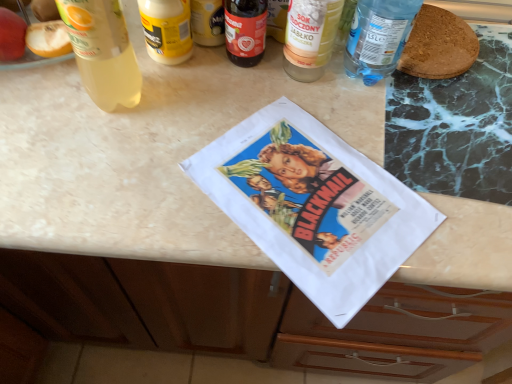
Question: Is translucent glass bottle at upper center, positioned as the 4th bottle in left-to-right order, located within dark red glass bottle at center, the third bottle from the left?

Choices:
 (A) no
 (B) yes

Answer: (A)

Question: Considering the relative sizes of dark red glass bottle at center, the third bottle from the left, and translucent glass bottle at upper center, positioned as the 4th bottle in left-to-right order, in the image provided, is dark red glass bottle at center, the third bottle from the left, wider than translucent glass bottle at upper center, positioned as the 4th bottle in left-to-right order,?

Choices:
 (A) yes
 (B) no

Answer: (A)

Question: Can you confirm if dark red glass bottle at center, the third bottle from the left, is positioned to the right of translucent glass bottle at upper center, positioned as the 4th bottle in left-to-right order?

Choices:
 (A) no
 (B) yes

Answer: (A)

Question: Is dark red glass bottle at center, arranged as the third bottle when viewed from the right, not inside translucent glass bottle at upper center, which is counted as the 2th bottle, starting from the right?

Choices:
 (A) yes
 (B) no

Answer: (A)

Question: From the image's perspective, is dark red glass bottle at center, the third bottle from the left, on top of translucent glass bottle at upper center, positioned as the 4th bottle in left-to-right order?

Choices:
 (A) no
 (B) yes

Answer: (A)

Question: Could you tell me if dark red glass bottle at center, arranged as the third bottle when viewed from the right, is facing translucent glass bottle at upper center, positioned as the 4th bottle in left-to-right order?

Choices:
 (A) no
 (B) yes

Answer: (A)

Question: From a real-world perspective, is yellow matte jar at upper center, marked as the second bottle in a left-to-right arrangement, over dark red glass bottle at center, the third bottle from the left?

Choices:
 (A) no
 (B) yes

Answer: (B)

Question: Is yellow matte jar at upper center, marked as the second bottle in a left-to-right arrangement, facing towards dark red glass bottle at center, arranged as the third bottle when viewed from the right?

Choices:
 (A) yes
 (B) no

Answer: (B)

Question: Considering the relative sizes of yellow matte jar at upper center, marked as the second bottle in a left-to-right arrangement, and dark red glass bottle at center, arranged as the third bottle when viewed from the right, in the image provided, is yellow matte jar at upper center, marked as the second bottle in a left-to-right arrangement, thinner than dark red glass bottle at center, arranged as the third bottle when viewed from the right,?

Choices:
 (A) no
 (B) yes

Answer: (A)

Question: Does yellow matte jar at upper center, marked as the second bottle in a left-to-right arrangement, have a smaller size compared to dark red glass bottle at center, the third bottle from the left?

Choices:
 (A) no
 (B) yes

Answer: (A)

Question: Considering the relative sizes of yellow matte jar at upper center, the fourth bottle from the right, and dark red glass bottle at center, the third bottle from the left, in the image provided, is yellow matte jar at upper center, the fourth bottle from the right, shorter than dark red glass bottle at center, the third bottle from the left,?

Choices:
 (A) yes
 (B) no

Answer: (B)

Question: From the image's perspective, is yellow matte jar at upper center, marked as the second bottle in a left-to-right arrangement, on dark red glass bottle at center, arranged as the third bottle when viewed from the right?

Choices:
 (A) no
 (B) yes

Answer: (B)

Question: Considering the relative sizes of yellow matte jar at upper center, marked as the second bottle in a left-to-right arrangement, and translucent plastic bottle at upper left, which is counted as the fifth bottle, starting from the right, in the image provided, is yellow matte jar at upper center, marked as the second bottle in a left-to-right arrangement, smaller than translucent plastic bottle at upper left, which is counted as the fifth bottle, starting from the right,?

Choices:
 (A) no
 (B) yes

Answer: (B)